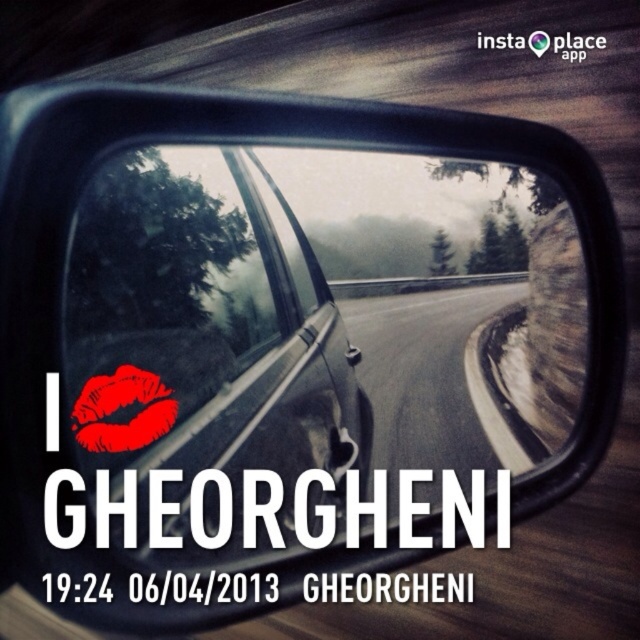
Question: Which point is farther to the camera?

Choices:
 (A) red matte lips at center
 (B) matte black car window at center
 (C) glossy metallic mirror at upper center

Answer: (C)

Question: From the image, what is the correct spatial relationship of glossy metallic mirror at upper center in relation to red matte lips at center?

Choices:
 (A) left
 (B) right

Answer: (B)

Question: Does glossy metallic mirror at upper center appear under red matte lips at center?

Choices:
 (A) no
 (B) yes

Answer: (A)

Question: Which point is farther to the camera?

Choices:
 (A) matte black car window at center
 (B) red matte lips at center

Answer: (B)

Question: Which point is closer to the camera?

Choices:
 (A) glossy metallic mirror at upper center
 (B) red matte lips at center
 (C) matte black car window at center

Answer: (C)

Question: Is glossy metallic mirror at upper center closer to the viewer compared to matte black car window at center?

Choices:
 (A) yes
 (B) no

Answer: (B)